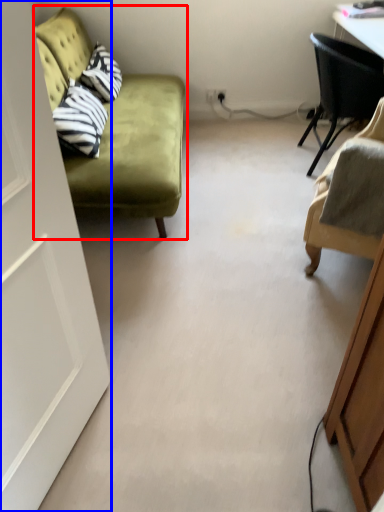
Question: Which of the following is the closest to the observer, studio couch (highlighted by a red box) or door (highlighted by a blue box)?

Choices:
 (A) studio couch
 (B) door

Answer: (B)